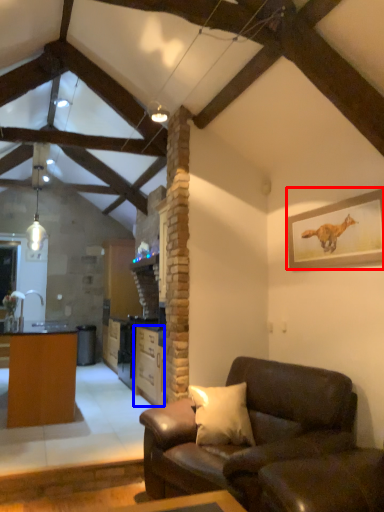
Question: Which object appears closest to the camera in this image, picture frame (highlighted by a red box) or cabinetry (highlighted by a blue box)?

Choices:
 (A) picture frame
 (B) cabinetry

Answer: (A)